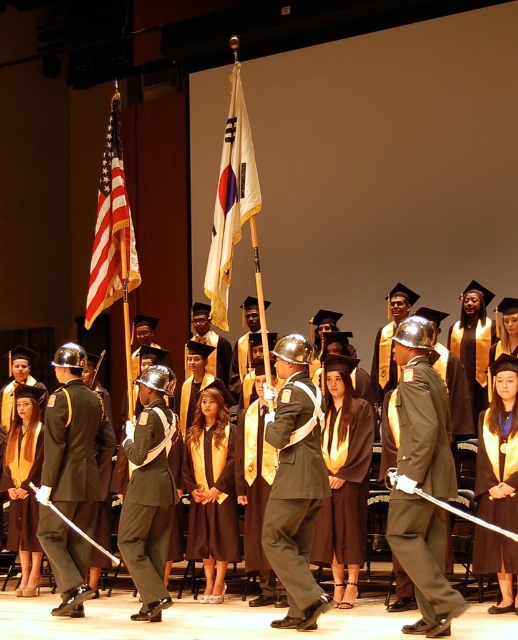
Which of these two, khaki fabric uniform at center or dark gray fabric uniform at center, stands shorter?

Standing shorter between the two is dark gray fabric uniform at center.

Is khaki fabric uniform at center closer to the viewer compared to dark gray fabric uniform at center?

Yes, it is in front of dark gray fabric uniform at center.

Measure the distance between point (444, 515) and camera.

They are 26.34 feet apart.

This screenshot has height=640, width=518. Identify the location of khaki fabric uniform at center. (424, 428).

Which is in front, point (437, 545) or point (237, 241)?

Point (437, 545) is more forward.

Locate an element on the screen. khaki fabric uniform at center is located at coordinates (424, 428).

Which is above, dark gray fabric uniform at center or shiny black uniform at center?

Positioned higher is dark gray fabric uniform at center.

Who is more distant from viewer, (285, 520) or (60, 577)?

The point (60, 577) is behind.

What do you see at coordinates (294, 493) in the screenshot?
I see `dark gray fabric uniform at center` at bounding box center [294, 493].

Find the location of `dark gray fabric uniform at center`. dark gray fabric uniform at center is located at coordinates (294, 493).